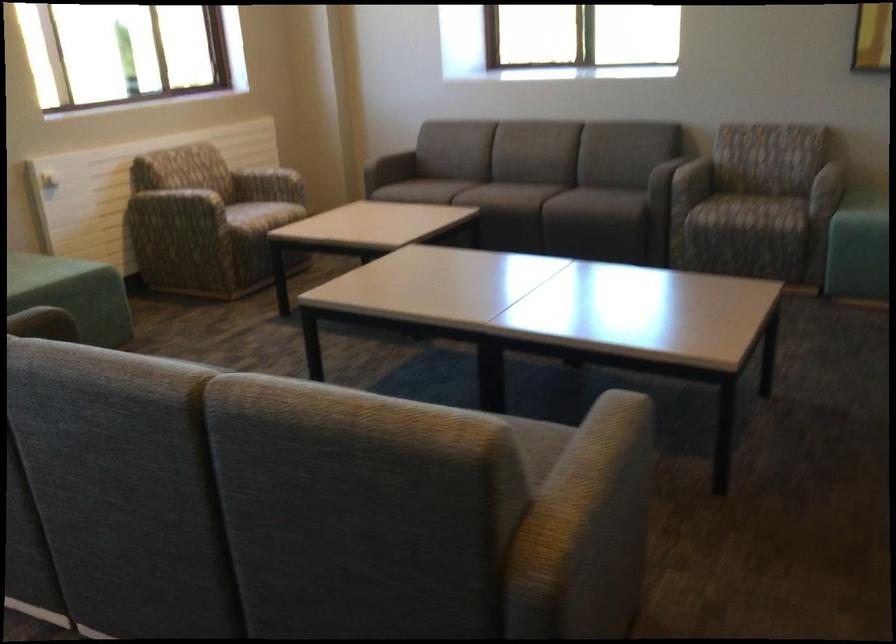
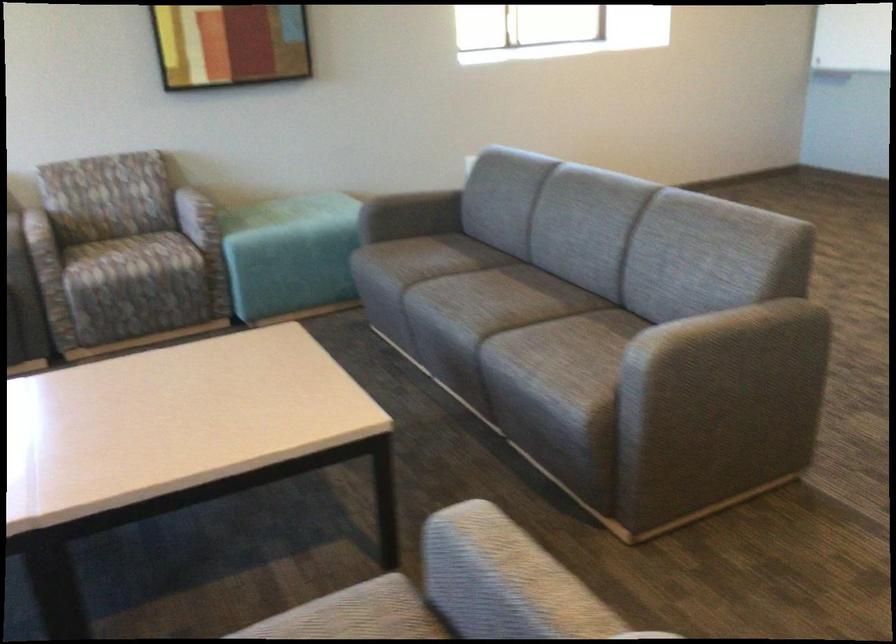
Find the pixel in the second image that matches [710,196] in the first image.

(125, 259)